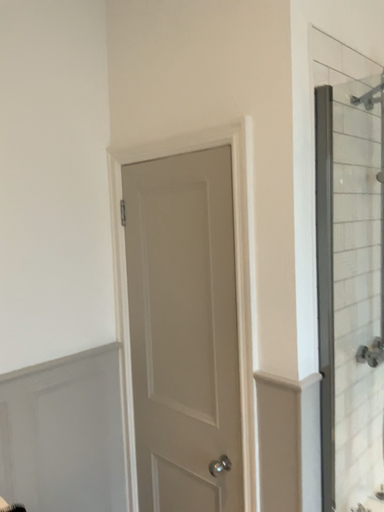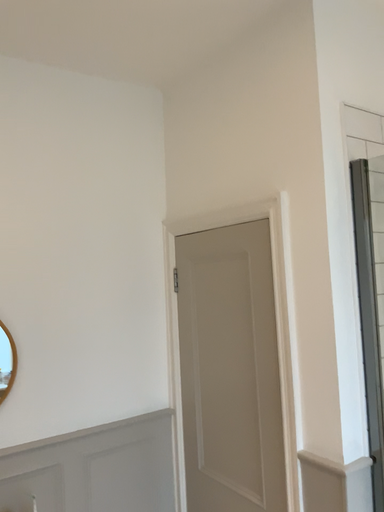
Question: Which way did the camera rotate in the video?

Choices:
 (A) rotated upward
 (B) rotated downward

Answer: (A)